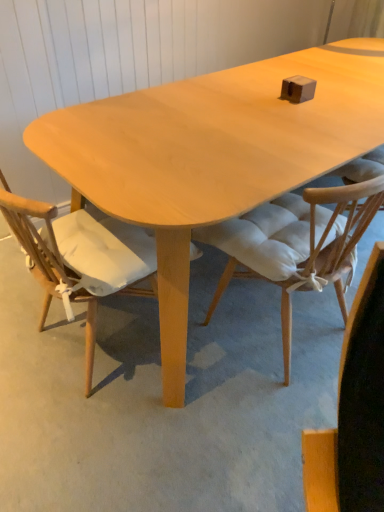
Where is `vacant area that lies to the right of light wood chair at center, which is the 2th chair in right-to-left order`? This screenshot has width=384, height=512. vacant area that lies to the right of light wood chair at center, which is the 2th chair in right-to-left order is located at coordinates (220, 370).